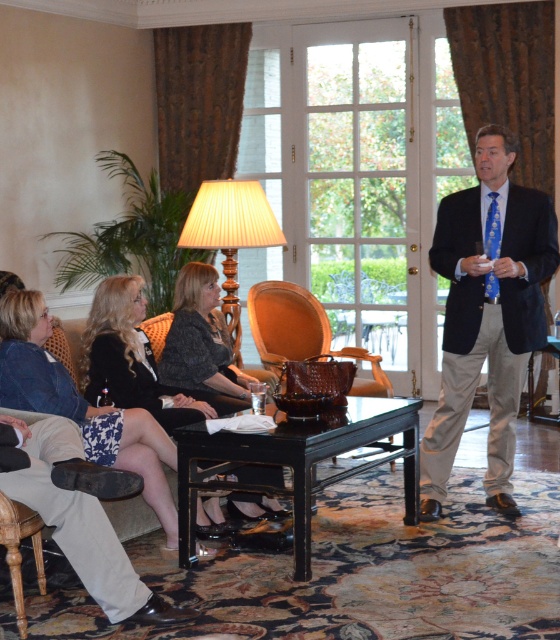
Where is the blue silk tie at center located in the image?

The blue silk tie at center is located at point coordinates of 0.491 on the x axis and 0.871 on the y axis.

Based on the photo, you are a guest at an event and need to retrieve your blue silk tie at center from the coffee table. There is a black textured dress at center nearby. Can you reach the tie without stepping on the dress?

The distance between the blue silk tie at center and the black textured dress at center is 4.67 feet, so you can easily reach the tie without stepping on the dress since they are sufficiently spaced apart.

You are a guest at a formal event and see the blue silk tie at center and the black textured dress at center on the coffee table. Which item is placed on top of the other?

The blue silk tie at center is positioned over the black textured dress at center, so it is placed on top.